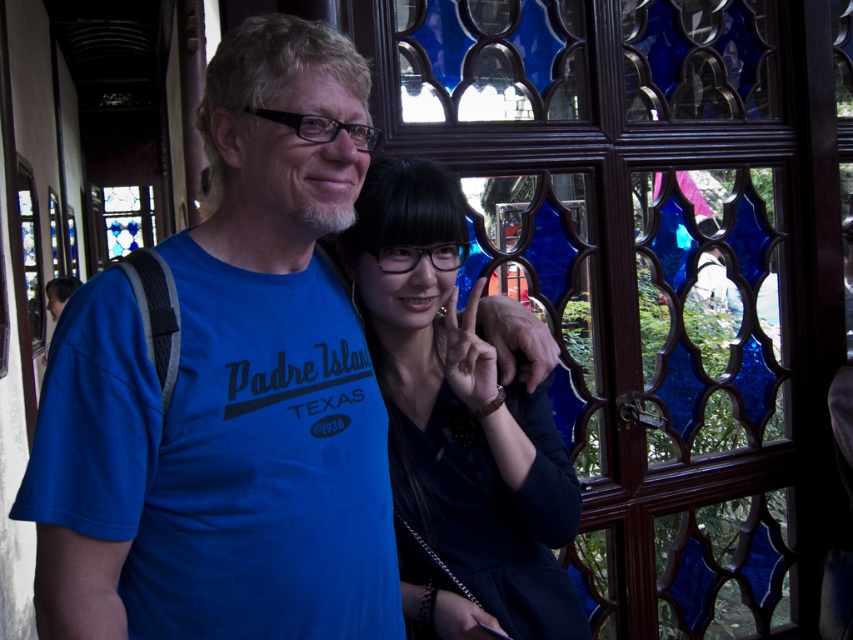
Which is more to the right, blue stained glass at center or blue cotton t-shirt at center?

From the viewer's perspective, blue stained glass at center appears more on the right side.

Is blue stained glass at center above blue cotton t-shirt at center?

Yes, blue stained glass at center is above blue cotton t-shirt at center.

Find the location of a particular element. The width and height of the screenshot is (853, 640). blue stained glass at center is located at coordinates (659, 269).

Is point (434, 220) positioned behind point (119, 232)?

No.

Is point (467, 628) positioned before point (131, 204)?

Yes, point (467, 628) is closer to viewer.

This screenshot has width=853, height=640. Find the location of `matte black jacket at center`. matte black jacket at center is located at coordinates (457, 426).

Is point (508, 147) closer to viewer compared to point (467, 406)?

That is False.

Which is above, blue stained glass at center or matte black jacket at center?

blue stained glass at center

Describe the element at coordinates (659, 269) in the screenshot. I see `blue stained glass at center` at that location.

Identify the location of blue stained glass at center. This screenshot has width=853, height=640. (659, 269).